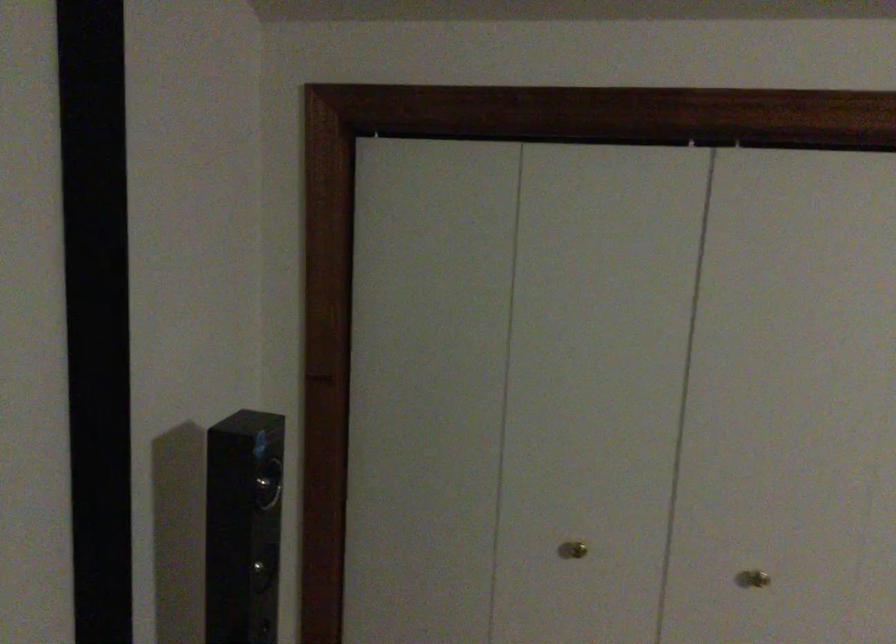
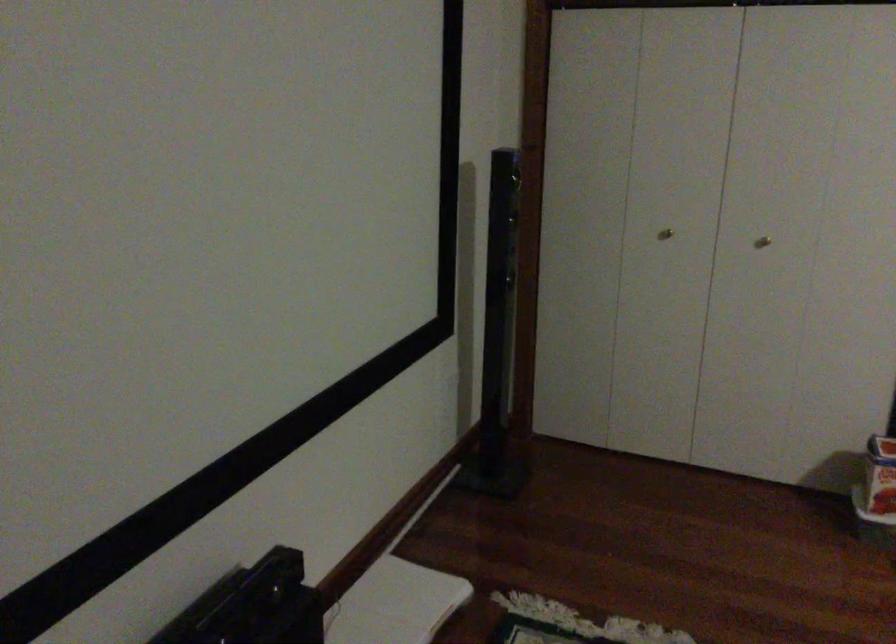
Locate, in the second image, the point that corresponds to point 580,552 in the first image.

(665, 234)